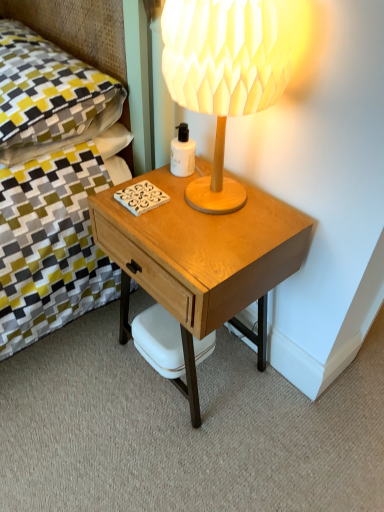
The width and height of the screenshot is (384, 512). Find the location of `vacant point to the left of light brown wood desk at center`. vacant point to the left of light brown wood desk at center is located at coordinates (77, 376).